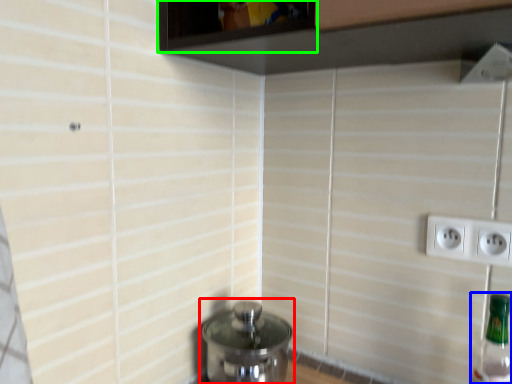
Question: Which object is the closest to the water heater (highlighted by a red box)? Choose among these: bottle (highlighted by a blue box) or window (highlighted by a green box).

Choices:
 (A) bottle
 (B) window

Answer: (A)